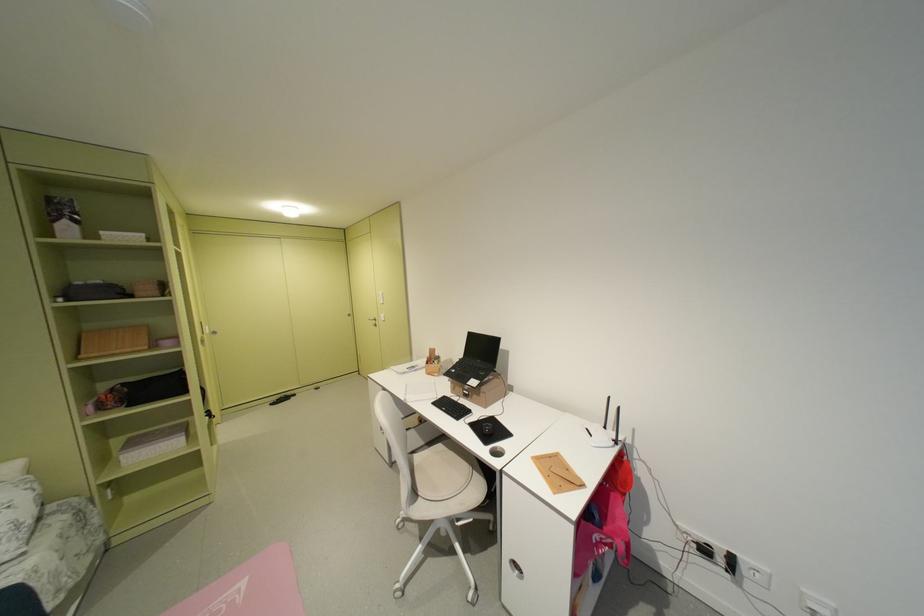
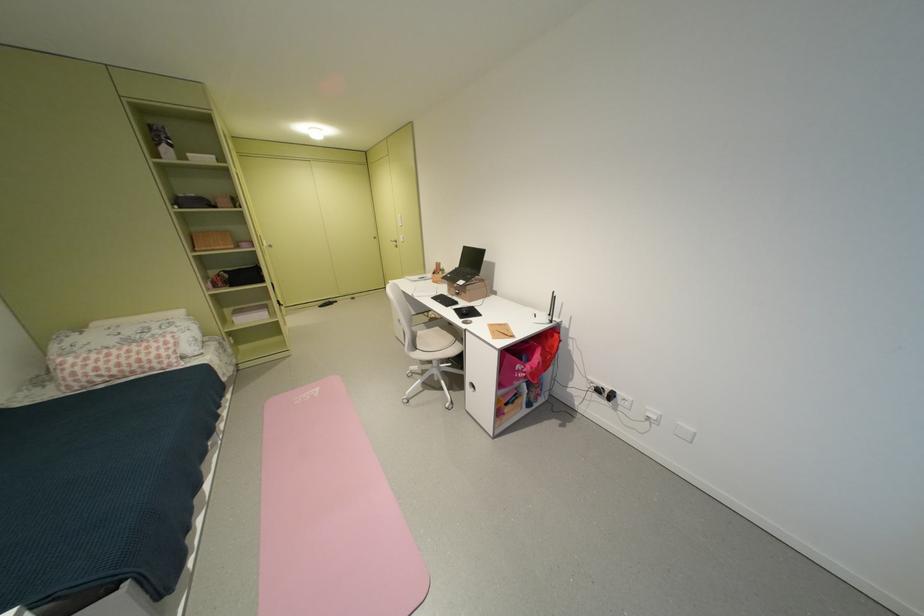
Locate, in the second image, the point that corresponds to point (714, 553) in the first image.

(609, 392)